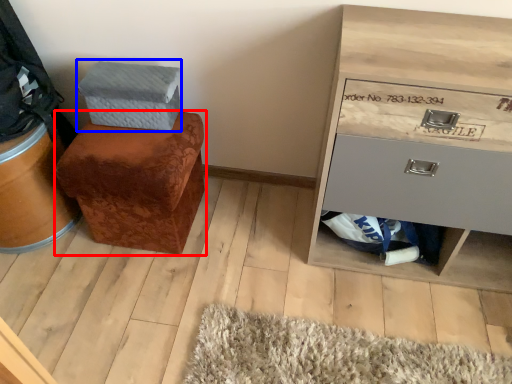
Question: Which object is further to the camera taking this photo, furniture (highlighted by a red box) or shoe box (highlighted by a blue box)?

Choices:
 (A) furniture
 (B) shoe box

Answer: (B)